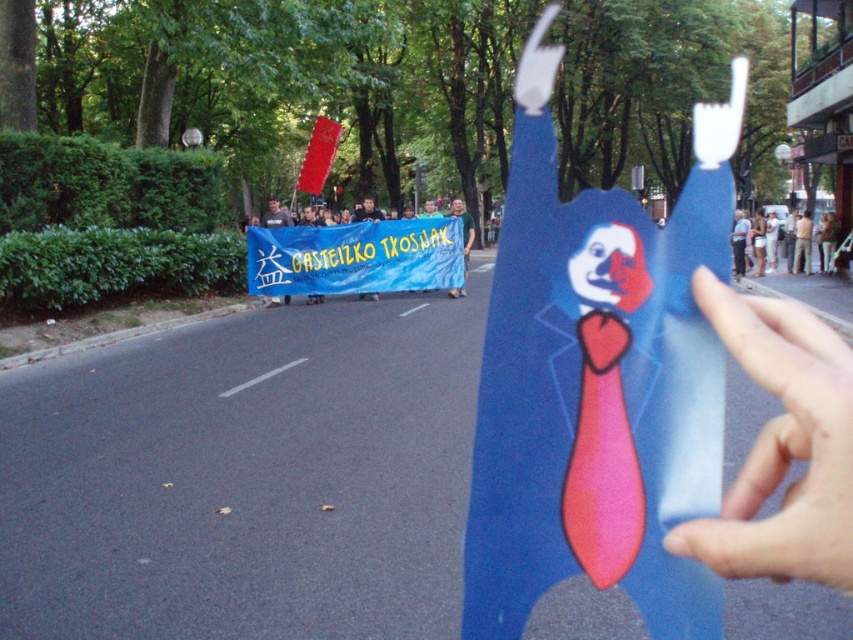
You are a photographer standing at the center of the street. You notice two points in the image labeled as point [827,504] and point [256,241]. Which point is closer to your camera lens?

Point [827,504] is in front of point [256,241], so it is closer to the camera lens.

You are a photographer trying to capture the blue banner with yellow text in the street scene. You notice a point marked at coordinates (x=782, y=445). Where is this point located relative to the smooth blue paper at center?

The point (x=782, y=445) is located on the smooth blue paper at center.